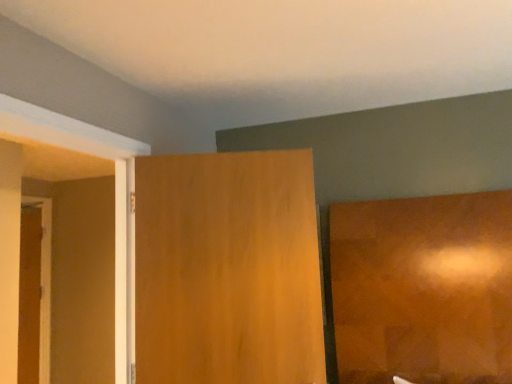
Locate an element on the screen. The width and height of the screenshot is (512, 384). wooden door at center is located at coordinates (227, 269).

What do you see at coordinates (227, 269) in the screenshot?
I see `wooden door at center` at bounding box center [227, 269].

Locate an element on the screen. The width and height of the screenshot is (512, 384). wooden door at center is located at coordinates (227, 269).